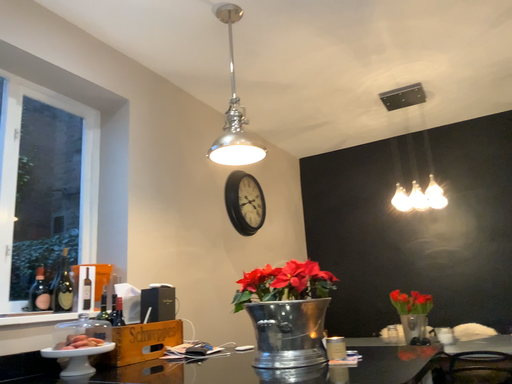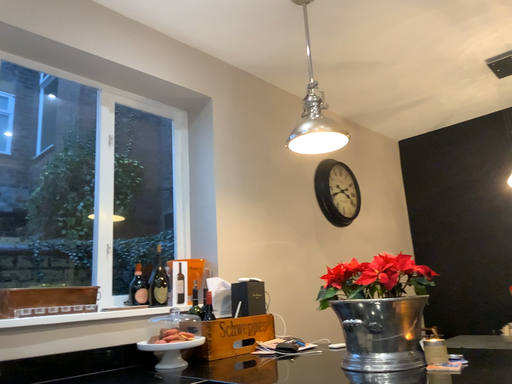
Question: Which way did the camera rotate in the video?

Choices:
 (A) rotated left
 (B) rotated right

Answer: (A)